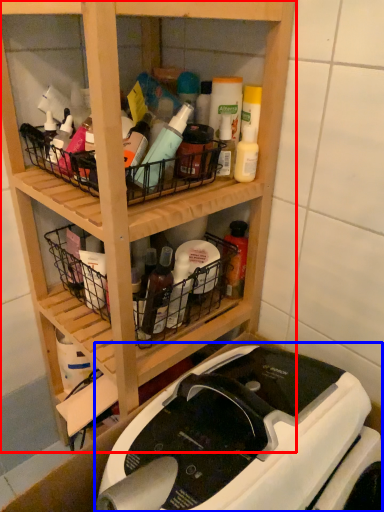
Question: Among these objects, which one is farthest to the camera, shelf (highlighted by a red box) or sewing machine (highlighted by a blue box)?

Choices:
 (A) shelf
 (B) sewing machine

Answer: (A)